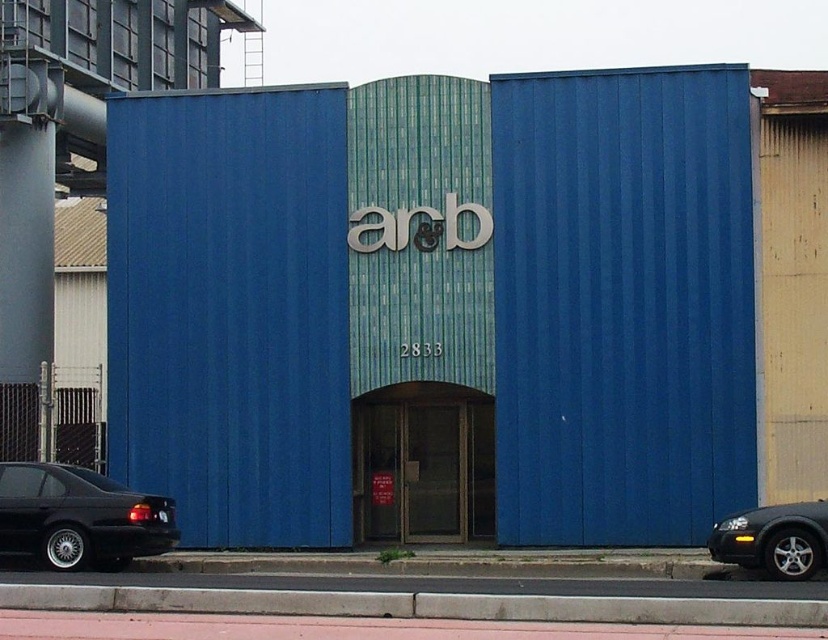
You are a delivery driver who needs to unload a package onto the pink rubber curb at lower center. Your vehicle is the black matte sedan at lower left. Can you safely drive over the curb without damaging the car?

The pink rubber curb at lower center has a lesser height compared to the black matte sedan at lower left. Since the curb is lower than the car, you can safely drive over it without damaging the car.

You are a delivery driver who needs to park your truck next to the building. You see a black matte sedan at lower left and a shiny silver sedan at lower right. Which car should you avoid parking too close to if you want to ensure your truck won ground clearance when leaving the spot?

You should avoid parking too close to the black matte sedan at lower left because it is taller than the shiny silver sedan at lower right, which means it might require more space to maneuver around without scraping the truck.

From the picture: You are a delivery driver who needs to park your vehicle in front of the building. You see a black matte sedan at lower left and a shiny silver sedan at lower right. Which parking spot should you choose to avoid blocking the entrance?

The black matte sedan at lower left is positioned on the left side of the shiny silver sedan at lower right. To avoid blocking the entrance, you should park on the right side of the shiny silver sedan at lower right, as it is closer to the entrance.